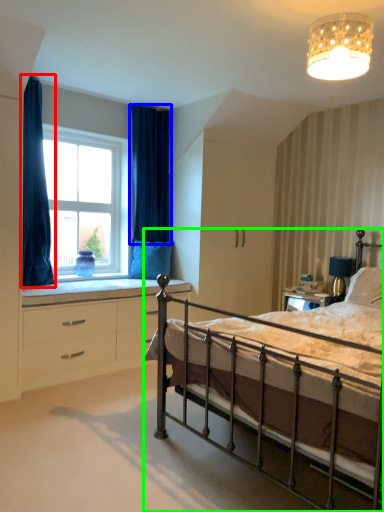
Question: Which object is positioned farthest from curtain (highlighted by a red box)? Select from curtain (highlighted by a blue box) and bed (highlighted by a green box).

Choices:
 (A) curtain
 (B) bed

Answer: (B)